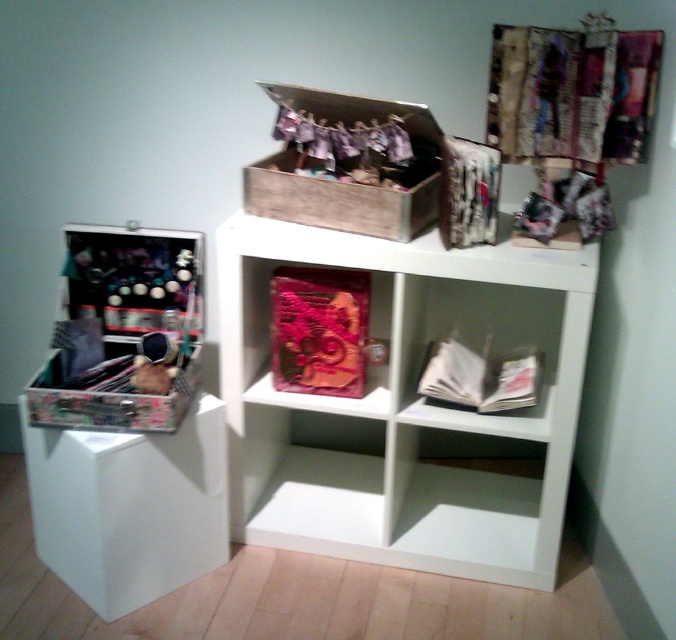
You are trying to place a 20 cm wide decorative item on the white matte bookshelf at center. There is a pink fabric box at center already occupying space. Can the item fit between them?

The white matte bookshelf at center and pink fabric box at center are 20.33 centimeters apart. Since the decorative item is 20 cm wide, it can fit between them as the space is slightly larger than the item.

You are trying to place a new decorative item on the white matte bookshelf at center. The item requires a space that is at least 16 inches away from the wooden box at center to avoid clutter. Based on the scene description, do you think the space between them is sufficient?

The white matte bookshelf at center is 15.85 inches away from the wooden box at center. Since the required distance is 16 inches, the space is insufficient by 0.15 inches.